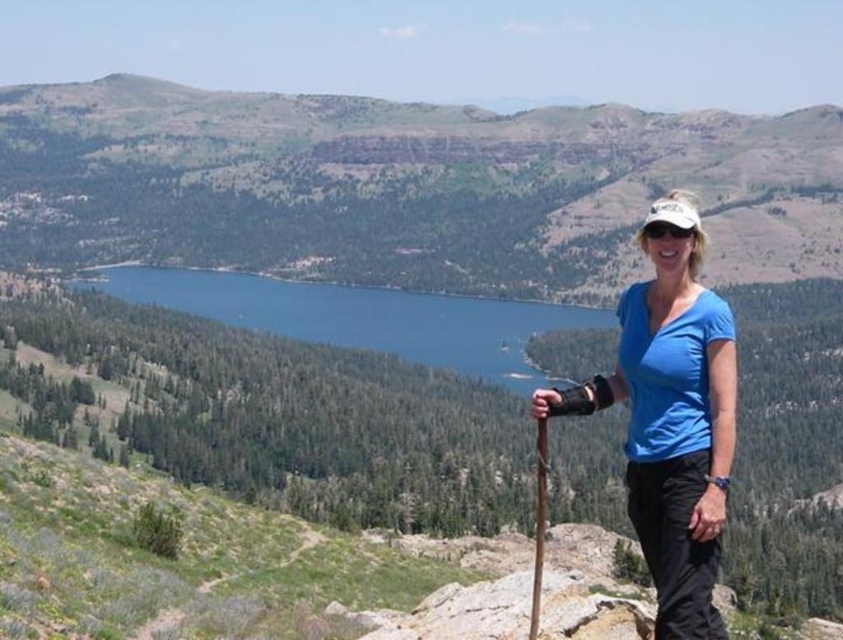
Question: Which object is the farthest from the green grassy mountain at center?

Choices:
 (A) blue glassy lake at center
 (B) blue fabric shirt at right

Answer: (B)

Question: Estimate the real-world distances between objects in this image. Which object is closer to the blue fabric shirt at right?

Choices:
 (A) green grassy mountain at center
 (B) blue glassy lake at center

Answer: (B)

Question: Is blue fabric shirt at right smaller than blue glassy lake at center?

Choices:
 (A) no
 (B) yes

Answer: (A)

Question: Is green grassy mountain at center thinner than blue fabric shirt at right?

Choices:
 (A) yes
 (B) no

Answer: (B)

Question: Among these points, which one is nearest to the camera?

Choices:
 (A) (701, 492)
 (B) (124, 291)

Answer: (A)

Question: Does blue fabric shirt at right appear over blue glassy lake at center?

Choices:
 (A) no
 (B) yes

Answer: (A)